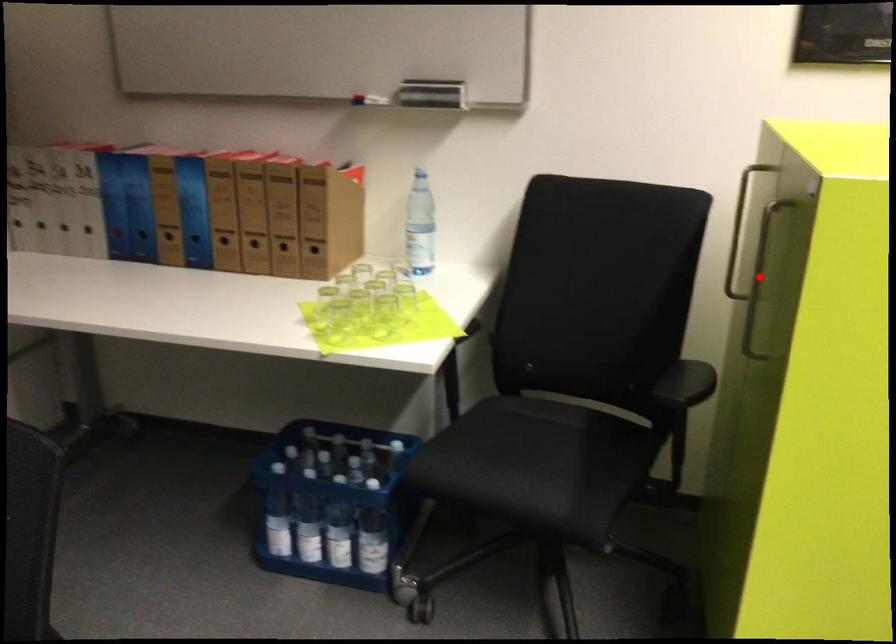
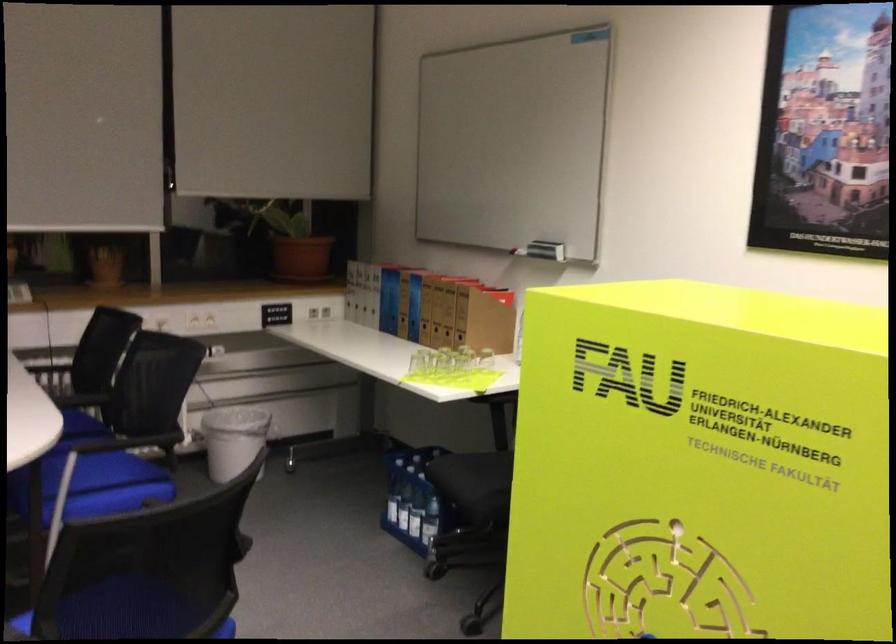
Question: I am providing you with two images of the same scene from different viewpoints. A red point is marked on the first image. Can you still see the location of the red point in image 2?

Choices:
 (A) Yes
 (B) No

Answer: (B)